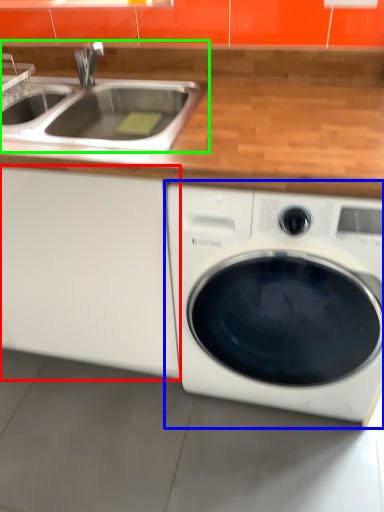
Question: Based on their relative distances, which object is farther from cabinetry (highlighted by a red box)? Choose from washing machine (highlighted by a blue box) and sink (highlighted by a green box).

Choices:
 (A) washing machine
 (B) sink

Answer: (B)